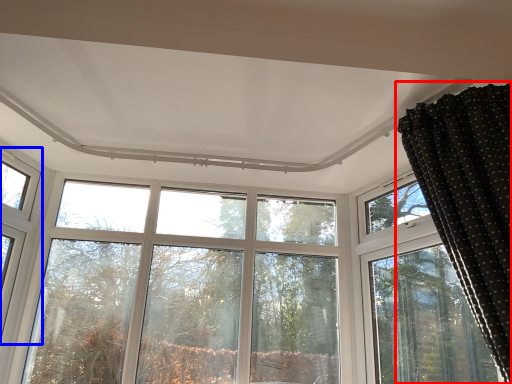
Question: Which object is further to the camera taking this photo, curtain (highlighted by a red box) or window (highlighted by a blue box)?

Choices:
 (A) curtain
 (B) window

Answer: (B)